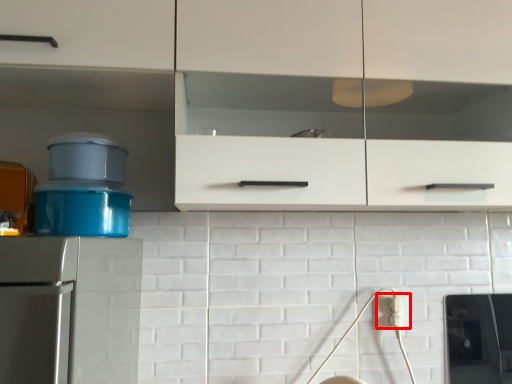
Question: From the image's perspective, where is electric outlet (annotated by the red box) located relative to cabinetry?

Choices:
 (A) above
 (B) below

Answer: (B)